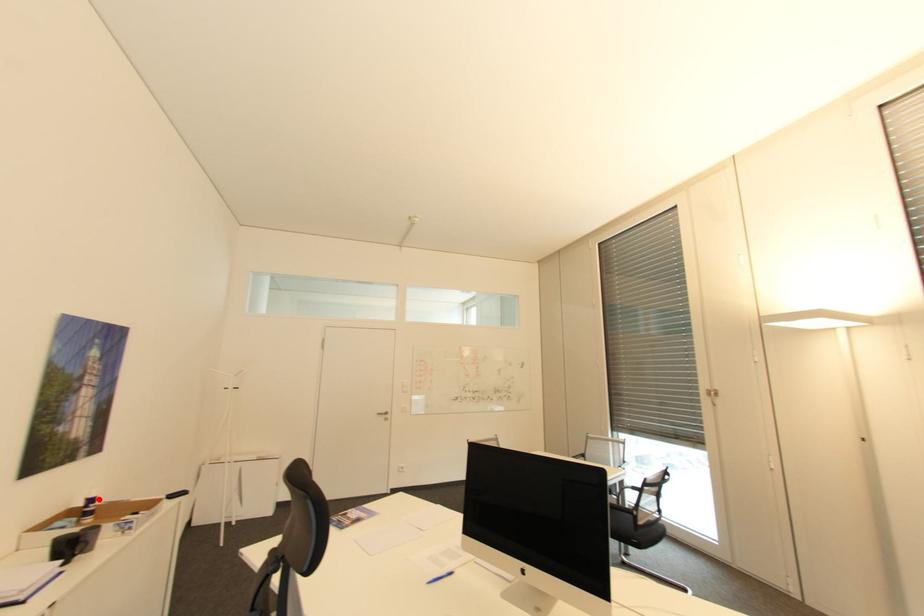
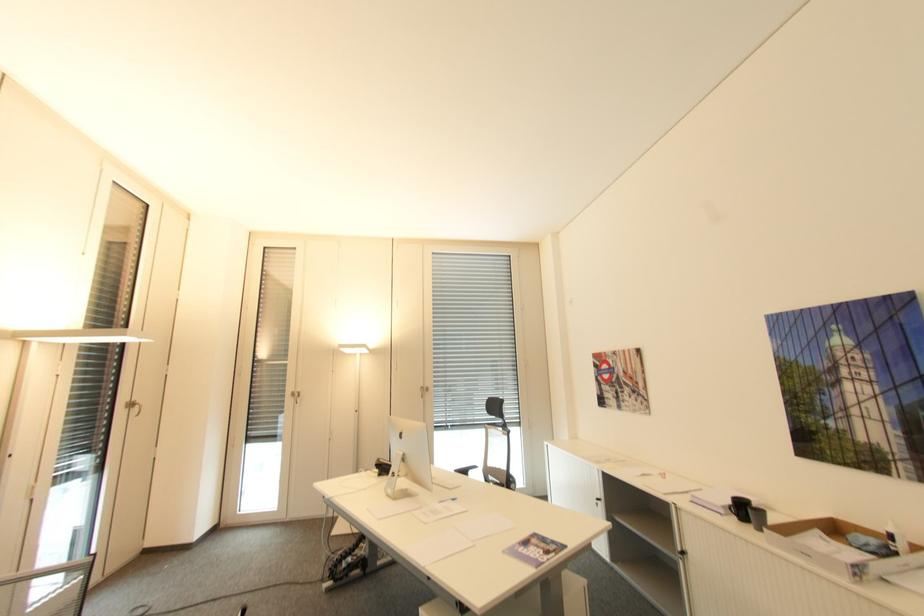
Question: I am providing you with two images of the same scene from different viewpoints. Image1 has a red point marked. In image2, the corresponding 3D location appears at what relative position? Reply with the corresponding letter.

Choices:
 (A) Closer
 (B) Farther

Answer: (A)